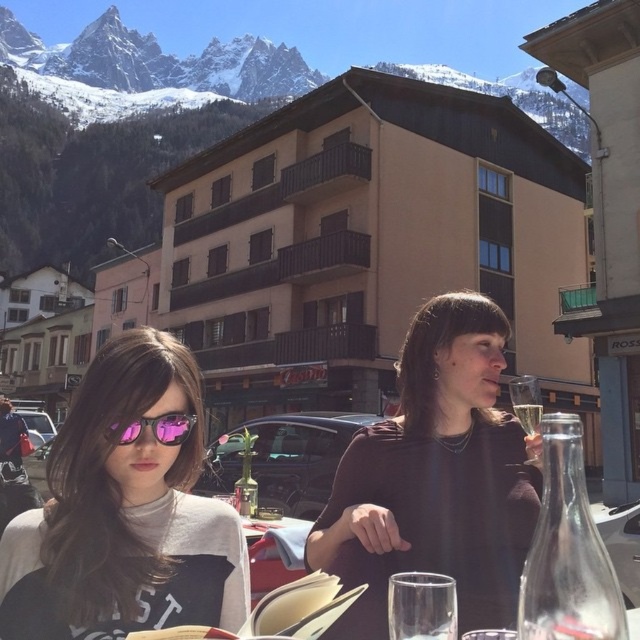
You are a photographer trying to capture both the beige wood hotel at center and the matte black dress at center in a single shot. Given their sizes, which object should you focus on to ensure both are clearly visible in the photo?

The beige wood hotel at center is bigger than the matte black dress at center, so you should focus on the beige wood hotel at center to ensure both objects are clearly visible in the photo.

You are a visitor who wants to take a photo of the beige wood hotel at center and the transparent glass at lower center. Which object should you focus on first if you want to capture both in a single frame without moving the camera?

The beige wood hotel at center is wider than the transparent glass at lower center, so you should focus on the beige wood hotel at center first to ensure it fits in the frame before adjusting for the smaller transparent glass at lower center.